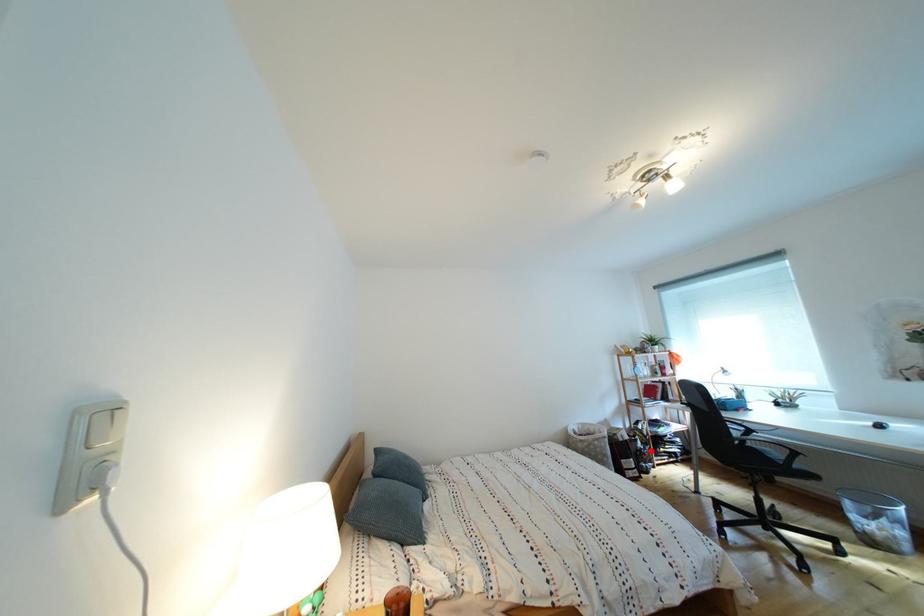
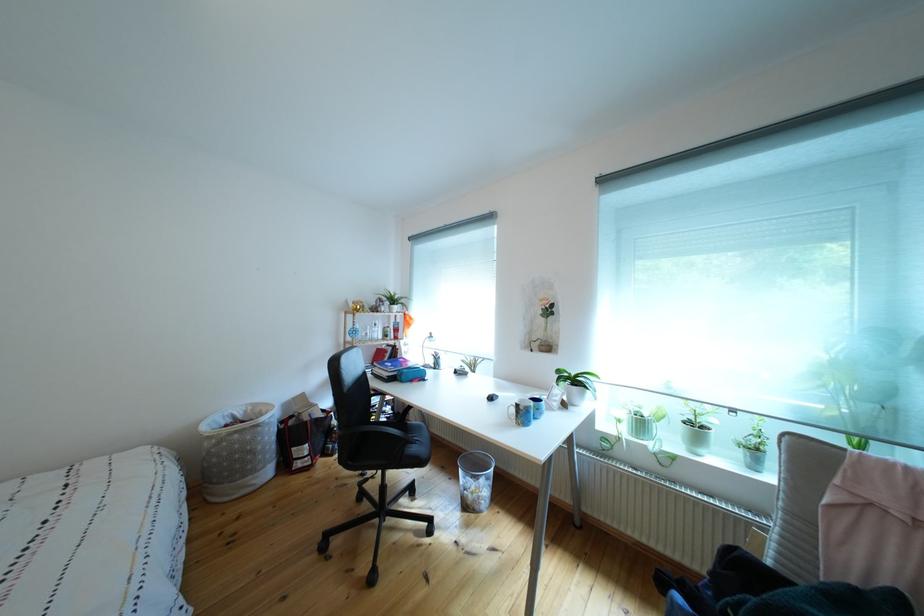
Question: A red point is marked in image1. In image2, is the corresponding 3D point closer to the camera or farther? Reply with the corresponding letter.

Choices:
 (A) The corresponding 3D point is closer.
 (B) The corresponding 3D point is farther.

Answer: (B)